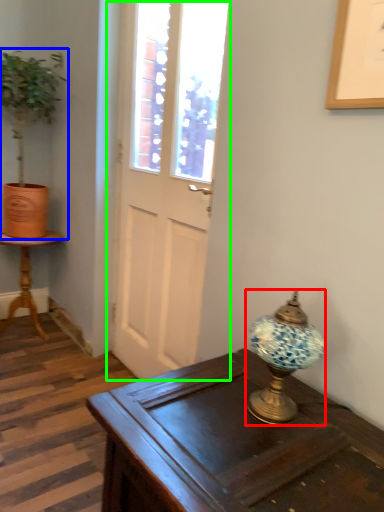
Question: Based on their relative distances, which object is nearer to lamp (highlighted by a red box)? Choose from houseplant (highlighted by a blue box) and door (highlighted by a green box).

Choices:
 (A) houseplant
 (B) door

Answer: (B)